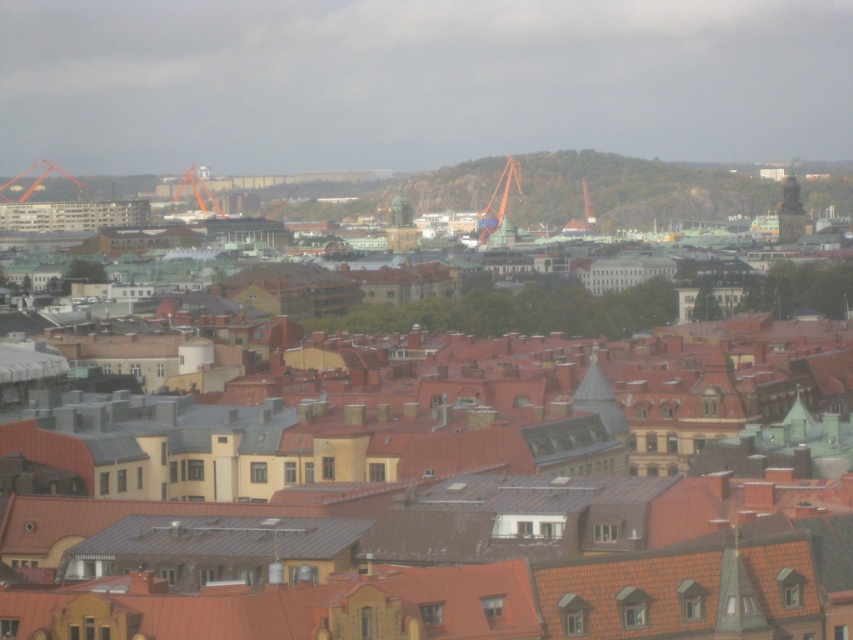
You are a city planner analyzing the urban layout. You notice the matte black tower at upper right and the orange metallic crane at upper left. Which structure is closer to the foreground of the image?

The matte black tower at upper right is positioned under the orange metallic crane at upper left, meaning it is closer to the foreground.

You are standing in the urban area depicted in the image and want to take a photo. You notice two points in the scene labeled as point (413, 225) and point (190, 176). Which point would appear larger in your camera view?

Point (413, 225) is closer to the camera than point (190, 176), so it would appear larger in the camera view.

You are standing in the urban area shown in the image and want to move from the point at coordinates point (39,429) to the point at coordinates point (392,236). Considering the scene description, which direction should you move to get closer to your destination?

To move from point (39,429) to point (392,236), you should move upward because point (39,429) is closer to the camera than point (392,236), meaning it is located in the foreground. Moving toward the background would bring you closer to the destination.